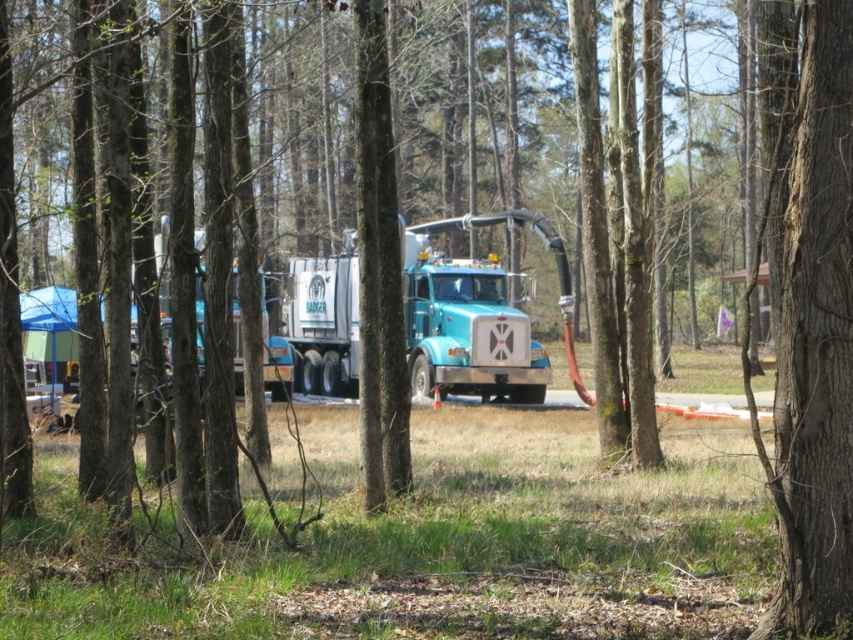
Is point (817, 22) closer to camera compared to point (457, 266)?

Yes, point (817, 22) is closer to viewer.

Is point (816, 348) behind point (354, 284)?

No, (816, 348) is closer to viewer.

Does point (816, 577) lie in front of point (329, 353)?

Yes, it is in front of point (329, 353).

You are a GUI agent. You are given a task and a screenshot of the screen. Output one action in this format:
    pyautogui.click(x=<x>, y=<y>)
    Task: Click on the smooth bark tree at center
    The height and width of the screenshot is (640, 853).
    Given the screenshot: What is the action you would take?
    pyautogui.click(x=810, y=308)